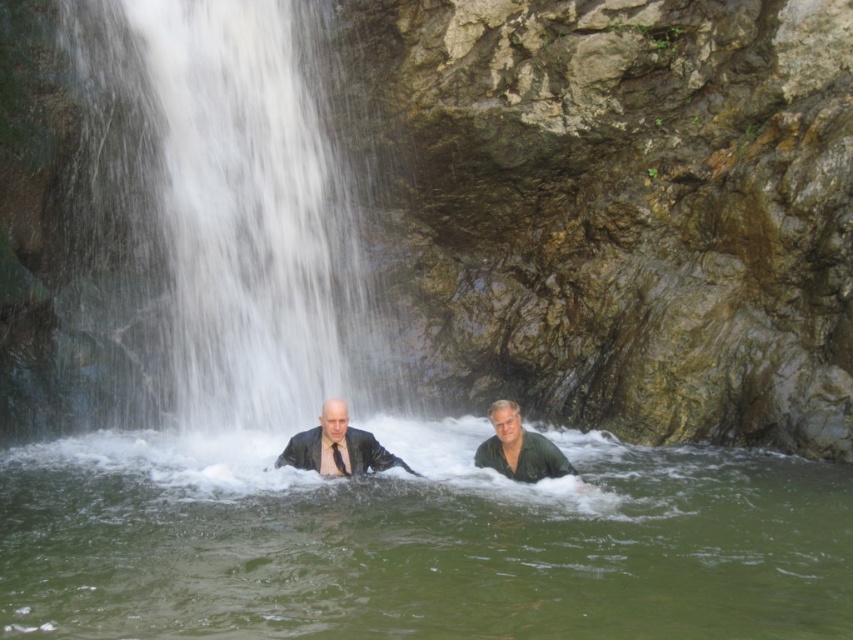
Question: Estimate the real-world distances between objects in this image. Which object is closer to the matte black suit at center?

Choices:
 (A) white frothy water at center
 (B) green matte shirt at center
 (C) green liquid water at center

Answer: (B)

Question: Can you confirm if green liquid water at center is thinner than white frothy water at center?

Choices:
 (A) no
 (B) yes

Answer: (A)

Question: Can you confirm if white frothy water at center is positioned to the right of dark green leather jacket at center?

Choices:
 (A) yes
 (B) no

Answer: (B)

Question: Among these points, which one is farthest from the camera?

Choices:
 (A) (511, 461)
 (B) (322, 381)
 (C) (271, 481)
 (D) (500, 461)

Answer: (B)

Question: Does white frothy water at center appear over matte black suit at center?

Choices:
 (A) yes
 (B) no

Answer: (A)

Question: Which object is farther from the camera taking this photo?

Choices:
 (A) white frothy water at center
 (B) green matte shirt at center
 (C) dark green leather jacket at center

Answer: (A)